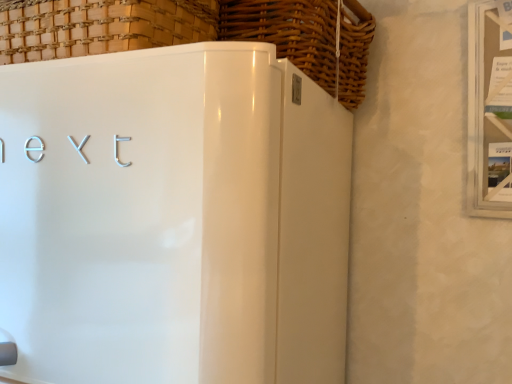
Question: From a real-world perspective, is woven wood basket at upper left, the second basket in the right-to-left sequence, physically above white glossy refrigerator at center?

Choices:
 (A) no
 (B) yes

Answer: (B)

Question: Considering the relative sizes of woven wood basket at upper left, the 1th basket viewed from the left, and white glossy refrigerator at center in the image provided, is woven wood basket at upper left, the 1th basket viewed from the left, smaller than white glossy refrigerator at center?

Choices:
 (A) no
 (B) yes

Answer: (B)

Question: Is woven wood basket at upper left, the 1th basket viewed from the left, positioned with its back to white glossy refrigerator at center?

Choices:
 (A) no
 (B) yes

Answer: (A)

Question: Is woven wood basket at upper left, the second basket in the right-to-left sequence, oriented towards white glossy refrigerator at center?

Choices:
 (A) yes
 (B) no

Answer: (B)

Question: Is woven wood basket at upper left, the second basket in the right-to-left sequence, surrounding white glossy refrigerator at center?

Choices:
 (A) no
 (B) yes

Answer: (A)

Question: From a real-world perspective, is woven wood basket at upper left, the second basket in the right-to-left sequence, positioned above or below woven wood basket at upper center, the 2th basket when ordered from left to right?

Choices:
 (A) above
 (B) below

Answer: (B)

Question: Is woven wood basket at upper left, the second basket in the right-to-left sequence, in front of or behind woven wood basket at upper center, the 2th basket when ordered from left to right, in the image?

Choices:
 (A) front
 (B) behind

Answer: (A)

Question: From the image's perspective, is woven wood basket at upper left, the 1th basket viewed from the left, positioned above or below woven wood basket at upper center, the 2th basket when ordered from left to right?

Choices:
 (A) above
 (B) below

Answer: (B)

Question: In terms of height, does woven wood basket at upper left, the 1th basket viewed from the left, look taller or shorter compared to woven wood basket at upper center, the 1th basket from the right?

Choices:
 (A) tall
 (B) short

Answer: (B)

Question: Considering their positions, is woven wood basket at upper center, the 2th basket when ordered from left to right, located in front of or behind white glossy refrigerator at center?

Choices:
 (A) behind
 (B) front

Answer: (A)

Question: Is woven wood basket at upper center, the 1th basket from the right, situated inside white glossy refrigerator at center or outside?

Choices:
 (A) inside
 (B) outside

Answer: (B)

Question: From their relative heights in the image, would you say woven wood basket at upper center, the 2th basket when ordered from left to right, is taller or shorter than white glossy refrigerator at center?

Choices:
 (A) tall
 (B) short

Answer: (B)

Question: Does point (266, 36) appear closer or farther from the camera than point (90, 200)?

Choices:
 (A) closer
 (B) farther

Answer: (B)

Question: Would you say white glossy refrigerator at center is to the left or to the right of woven wood basket at upper center, the 2th basket when ordered from left to right, in the picture?

Choices:
 (A) right
 (B) left

Answer: (B)

Question: Based on their sizes in the image, would you say white glossy refrigerator at center is bigger or smaller than woven wood basket at upper center, the 1th basket from the right?

Choices:
 (A) small
 (B) big

Answer: (B)